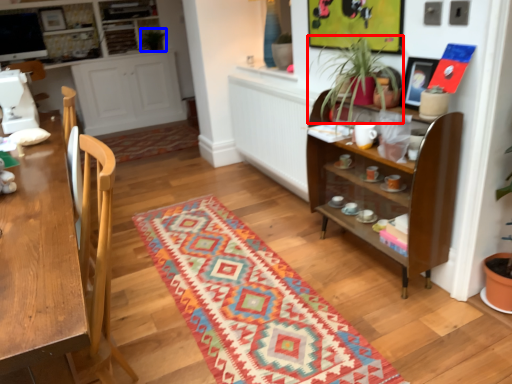
Question: Which object appears closest to the camera in this image, houseplant (highlighted by a red box) or plant (highlighted by a blue box)?

Choices:
 (A) houseplant
 (B) plant

Answer: (A)